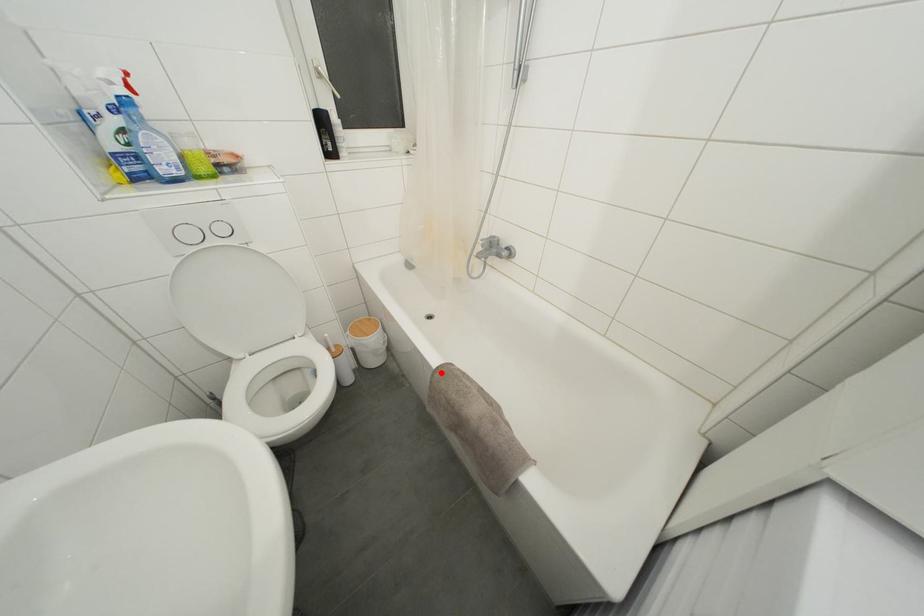
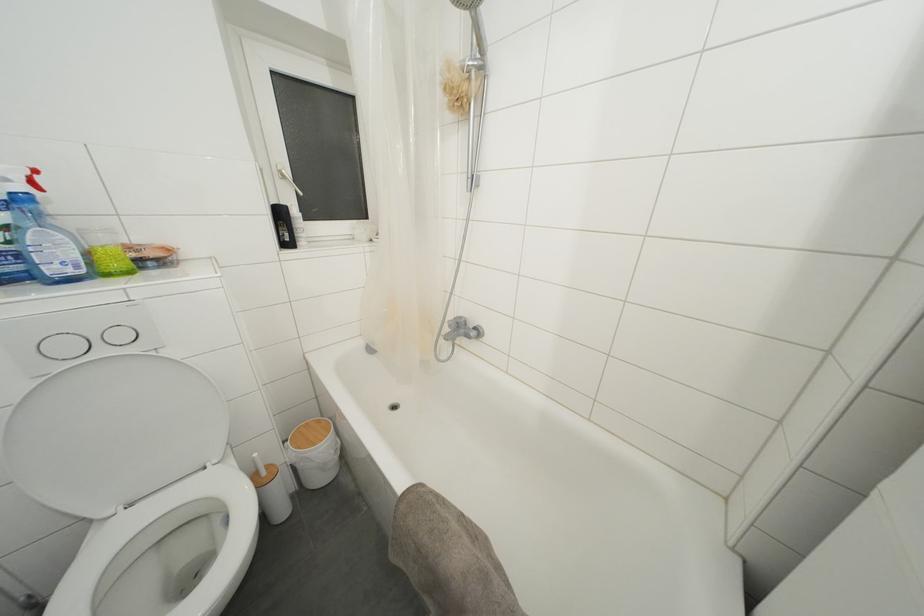
Find the pixel in the second image that matches the highlighted location in the first image.

(407, 498)